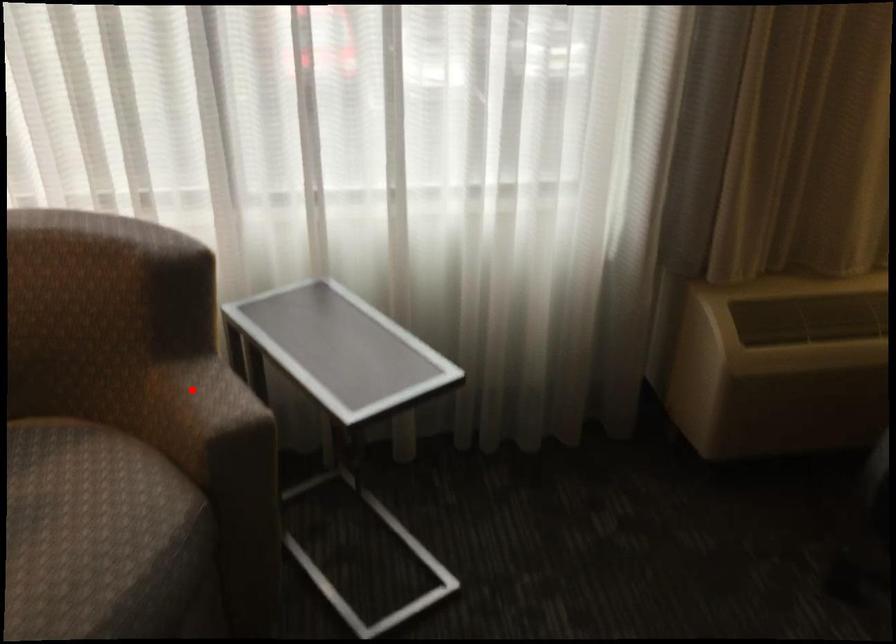
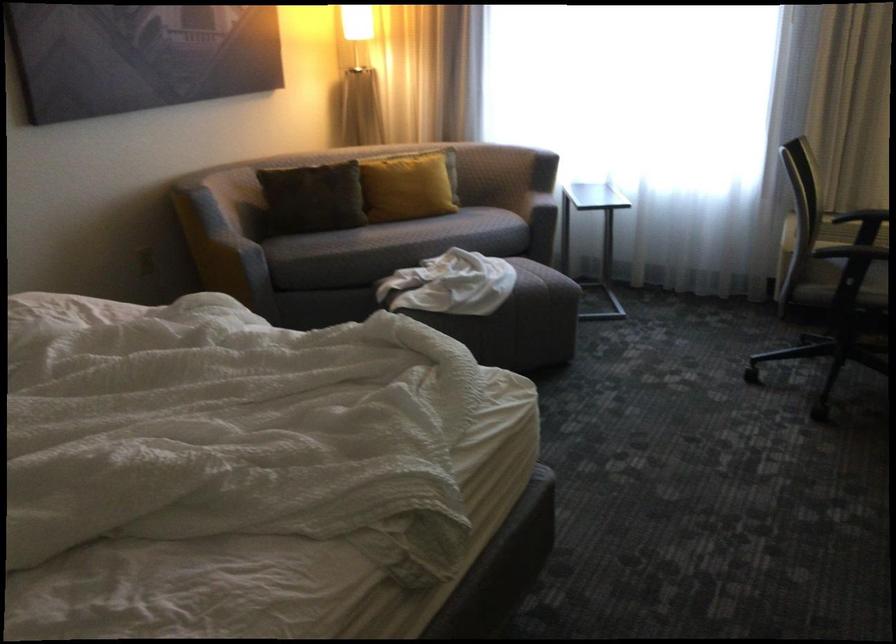
Question: I am providing you with two images of the same scene from different viewpoints. Image1 has a red point marked. In image2, the corresponding 3D location appears at what relative position? Reply with the corresponding letter.

Choices:
 (A) Closer
 (B) Farther

Answer: (B)